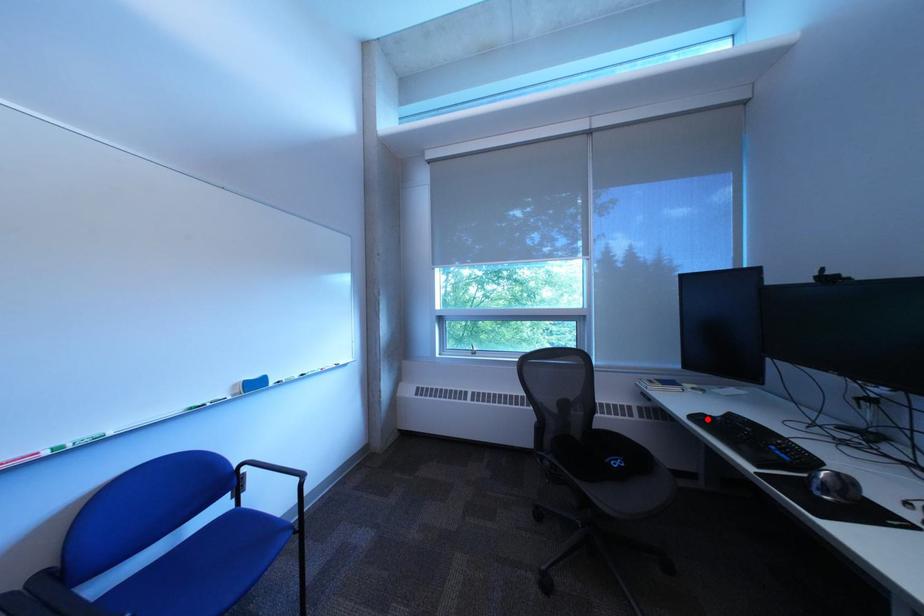
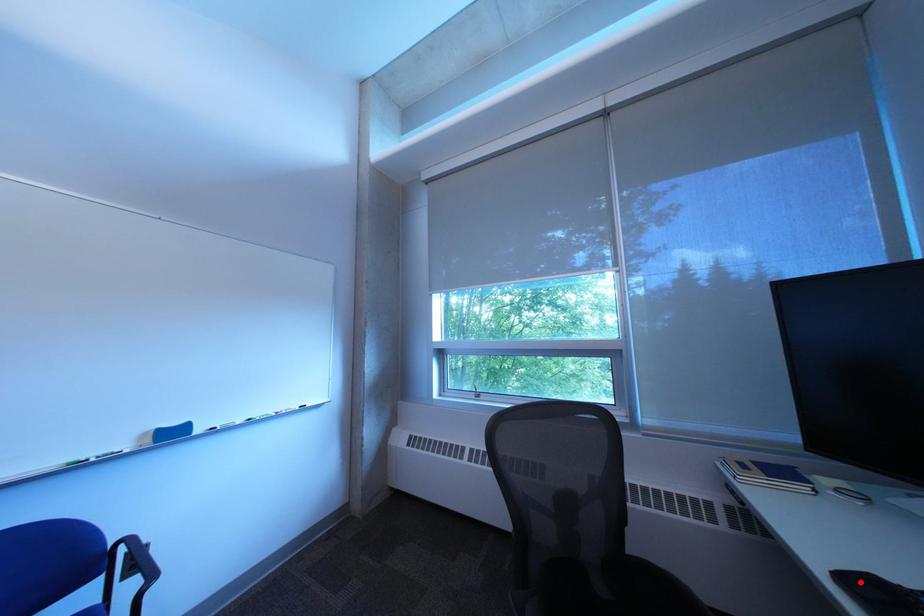
I am providing you with two images of the same scene from different viewpoints. A red point is marked on the first image and another point is marked on the second image. Are the points marked in image1 and image2 representing the same 3D position?

Yes